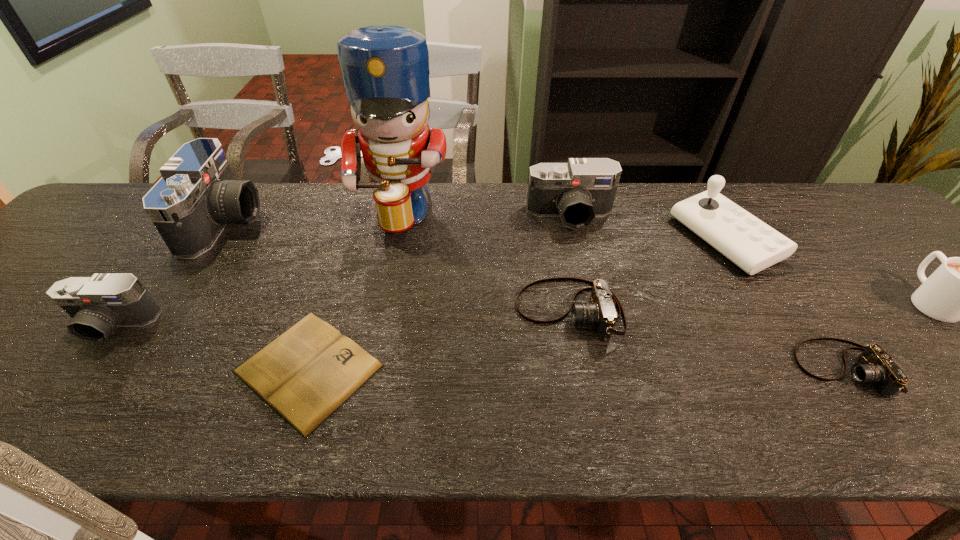
Identify the location of vacant region located on the front-facing side of the third shortest object. (376, 310).

What are the coordinates of `vacant space positioned 0.380m on the front-facing side of the third shortest object` in the screenshot? It's located at (350, 310).

Image resolution: width=960 pixels, height=540 pixels. Find the location of `free space located on the front-facing side of the right brown camera`. free space located on the front-facing side of the right brown camera is located at coordinates (617, 368).

The width and height of the screenshot is (960, 540). Identify the location of vacant position located 0.280m on the front-facing side of the right brown camera. (661, 368).

Where is `free region located on the front-facing side of the right brown camera`? The image size is (960, 540). free region located on the front-facing side of the right brown camera is located at coordinates (657, 368).

Where is `vacant space located 0.220m on the left of the shortest object`? The width and height of the screenshot is (960, 540). vacant space located 0.220m on the left of the shortest object is located at coordinates (125, 368).

Locate an element on the screen. The height and width of the screenshot is (540, 960). nutcracker that is at the far edge is located at coordinates (385, 68).

I want to click on joystick positioned at the far edge, so click(752, 245).

This screenshot has width=960, height=540. Identify the location of camera that is at the near edge. (875, 365).

Image resolution: width=960 pixels, height=540 pixels. I want to click on book at the near edge, so click(305, 374).